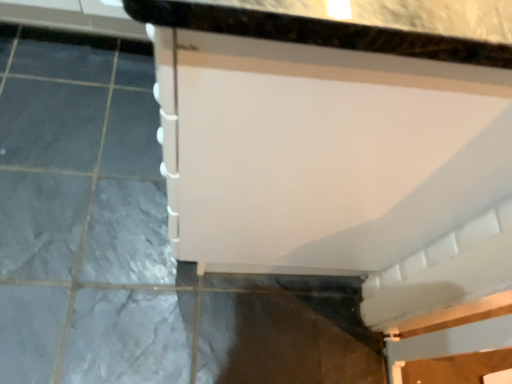
What is the approximate width of white glossy countertop at center?

22.57 inches.

You are a GUI agent. You are given a task and a screenshot of the screen. Output one action in this format:
    pyautogui.click(x=<x>, y=<y>)
    Task: Click on the white glossy countertop at center
    
    Given the screenshot: What is the action you would take?
    pyautogui.click(x=321, y=137)

Image resolution: width=512 pixels, height=384 pixels. What do you see at coordinates (321, 137) in the screenshot? I see `white glossy countertop at center` at bounding box center [321, 137].

The height and width of the screenshot is (384, 512). I want to click on white glossy countertop at center, so click(x=321, y=137).